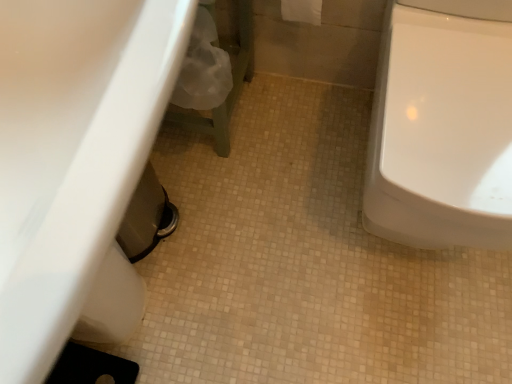
The height and width of the screenshot is (384, 512). What do you see at coordinates (72, 153) in the screenshot?
I see `white glossy sink at lower left` at bounding box center [72, 153].

Find the location of `white glossy toilet at right`. white glossy toilet at right is located at coordinates click(x=442, y=129).

Where is `white glossy sink at lower left`? white glossy sink at lower left is located at coordinates (72, 153).

Does white fabric toilet paper at upper center have a lesser width compared to white glossy sink at lower left?

Indeed, white fabric toilet paper at upper center has a lesser width compared to white glossy sink at lower left.

Can you confirm if white fabric toilet paper at upper center is positioned to the left of white glossy sink at lower left?

Incorrect, white fabric toilet paper at upper center is not on the left side of white glossy sink at lower left.

Which is further, (320, 5) or (49, 297)?

The point (320, 5) is behind.

Locate an element on the screen. toilet paper above the white glossy sink at lower left (from a real-world perspective) is located at coordinates (302, 11).

Between white glossy toilet at right and white fabric toilet paper at upper center, which one has less height?

white fabric toilet paper at upper center.

From the image's perspective, is white glossy toilet at right beneath white fabric toilet paper at upper center?

Yes, from the image's perspective, white glossy toilet at right is below white fabric toilet paper at upper center.

Is white glossy toilet at right oriented away from white fabric toilet paper at upper center?

That's not correct — white glossy toilet at right is not looking away from white fabric toilet paper at upper center.

Which is behind, white glossy toilet at right or white fabric toilet paper at upper center?

white fabric toilet paper at upper center is further from the camera.

Does white glossy sink at lower left have a lesser height compared to white fabric toilet paper at upper center?

No.

Consider the image. In the image, is white glossy sink at lower left positioned in front of or behind white fabric toilet paper at upper center?

white glossy sink at lower left is in front of white fabric toilet paper at upper center.

Can you confirm if white glossy sink at lower left is wider than white fabric toilet paper at upper center?

Yes, white glossy sink at lower left is wider than white fabric toilet paper at upper center.

Considering the sizes of white glossy toilet at right and white glossy sink at lower left in the image, is white glossy toilet at right wider or thinner than white glossy sink at lower left?

Clearly, white glossy toilet at right has more width compared to white glossy sink at lower left.

Measure the distance between white glossy toilet at right and white glossy sink at lower left.

59.46 centimeters.

From a real-world perspective, between white glossy toilet at right and white glossy sink at lower left, who is vertically lower?

From a 3D spatial view, white glossy toilet at right is below.

From the image's perspective, is white fabric toilet paper at upper center on top of white glossy toilet at right?

Yes.

From a real-world perspective, relative to white glossy toilet at right, is white fabric toilet paper at upper center vertically above or below?

Clearly, from a real-world perspective, white fabric toilet paper at upper center is above white glossy toilet at right.

From the image's perspective, which one is positioned lower, white glossy sink at lower left or white glossy toilet at right?

white glossy sink at lower left.

From a real-world perspective, between white glossy sink at lower left and white glossy toilet at right, who is vertically lower?

white glossy toilet at right.

Do you think white glossy sink at lower left is within white glossy toilet at right, or outside of it?

The correct answer is: outside.

Looking at this image, who is smaller, white glossy sink at lower left or white glossy toilet at right?

white glossy sink at lower left is smaller.

In order to click on toilet paper that appears on the right of white glossy sink at lower left in this screenshot , I will do `click(302, 11)`.

Find the location of a particular element. The image size is (512, 384). toilet paper behind the white glossy toilet at right is located at coordinates (302, 11).

Based on their spatial positions, is white glossy toilet at right or white glossy sink at lower left further from white fabric toilet paper at upper center?

The object further to white fabric toilet paper at upper center is white glossy sink at lower left.

Considering their positions, is white fabric toilet paper at upper center positioned closer to white glossy toilet at right than white glossy sink at lower left?

white fabric toilet paper at upper center.

Considering their positions, is white glossy toilet at right positioned closer to white glossy sink at lower left than white fabric toilet paper at upper center?

white glossy toilet at right is positioned closer to the anchor white glossy sink at lower left.

Estimate the real-world distances between objects in this image. Which object is closer to white fabric toilet paper at upper center, white glossy sink at lower left or white glossy toilet at right?

white glossy toilet at right.

From the image, which object appears to be farther from white glossy toilet at right, white glossy sink at lower left or white fabric toilet paper at upper center?

white glossy sink at lower left is further to white glossy toilet at right.

Estimate the real-world distances between objects in this image. Which object is further from white glossy sink at lower left, white fabric toilet paper at upper center or white glossy toilet at right?

The object further to white glossy sink at lower left is white fabric toilet paper at upper center.

Locate an element on the screen. The image size is (512, 384). toilet paper located between white glossy sink at lower left and white glossy toilet at right in the left-right direction is located at coordinates (302, 11).